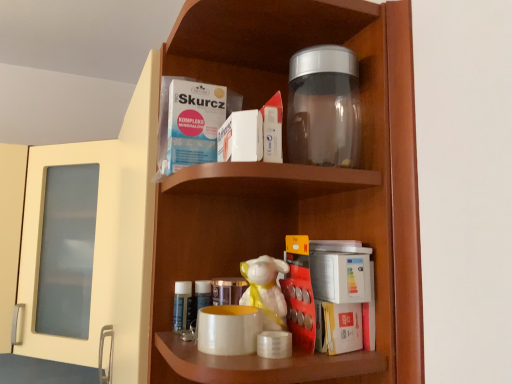
The height and width of the screenshot is (384, 512). What do you see at coordinates (297, 175) in the screenshot?
I see `transparent glass jar at upper center` at bounding box center [297, 175].

Identify the location of matte white mug at center. Image resolution: width=512 pixels, height=384 pixels. (228, 329).

This screenshot has width=512, height=384. What do you see at coordinates (228, 329) in the screenshot? I see `matte white mug at center` at bounding box center [228, 329].

What is the approximate height of transparent plastic jar at upper center?

It is 17.10 centimeters.

What is the approximate width of white glossy figurine at center?

white glossy figurine at center is 2.76 inches wide.

Identify the location of transparent glass jar at upper center. (297, 175).

Would you say matte white mug at center is a long distance from white glossy figurine at center?

They are positioned close to each other.

From the image's perspective, which is above, matte white mug at center or white glossy figurine at center?

white glossy figurine at center appears higher in the image.

Could you tell me if matte white mug at center is facing white glossy figurine at center?

No, matte white mug at center is not turned towards white glossy figurine at center.

Considering the positions of point (252, 308) and point (265, 297), is point (252, 308) closer or farther from the camera than point (265, 297)?

Point (252, 308) appears to be closer to the viewer than point (265, 297).

From a real-world perspective, who is located higher, matte white mug at center or transparent plastic jar at upper center?

From a 3D spatial view, transparent plastic jar at upper center is above.

From the image's perspective, is matte white mug at center above transparent plastic jar at upper center?

No, from the image's perspective, matte white mug at center is not above transparent plastic jar at upper center.

Is matte white mug at center smaller than transparent plastic jar at upper center?

Yes.

The image size is (512, 384). I want to click on bottle above the matte white mug at center (from the image's perspective), so click(x=324, y=107).

From the picture: From the image's perspective, who appears lower, matte white mug at center or transparent glass jar at upper center?

From the image's view, matte white mug at center is below.

How distant is matte white mug at center from transparent glass jar at upper center?

matte white mug at center is 9.31 inches away from transparent glass jar at upper center.

Does matte white mug at center appear on the right side of transparent glass jar at upper center?

Incorrect, matte white mug at center is not on the right side of transparent glass jar at upper center.

Is matte white mug at center shorter than transparent glass jar at upper center?

Indeed, matte white mug at center has a lesser height compared to transparent glass jar at upper center.

Which of these two, white glossy figurine at center or matte white mug at center, stands shorter?

Standing shorter between the two is matte white mug at center.

Based on the photo, is white glossy figurine at center inside the boundaries of matte white mug at center, or outside?

The correct answer is: outside.

Is the depth of white glossy figurine at center less than that of matte white mug at center?

No, it is behind matte white mug at center.

Based on the photo, could you tell me if white glossy figurine at center is facing matte white mug at center?

Yes, white glossy figurine at center is oriented towards matte white mug at center.

Looking at this image, is the position of transparent glass jar at upper center less distant than that of matte white mug at center?

Yes, it is in front of matte white mug at center.

From the image's perspective, is transparent glass jar at upper center above matte white mug at center?

Answer: Indeed, from the image's perspective, transparent glass jar at upper center is shown above matte white mug at center.

From a real-world perspective, who is located lower, transparent glass jar at upper center or matte white mug at center?

In real-world perspective, matte white mug at center is lower.

Who is taller, transparent glass jar at upper center or matte white mug at center?

With more height is transparent glass jar at upper center.

Consider the image. What's the angular difference between white glossy figurine at center and transparent plastic jar at upper center's facing directions?

The angle between the facing direction of white glossy figurine at center and the facing direction of transparent plastic jar at upper center is 3.42 degrees.

From a real-world perspective, does white glossy figurine at center stand above transparent plastic jar at upper center?

No, from a real-world perspective, white glossy figurine at center is not over transparent plastic jar at upper center

The width and height of the screenshot is (512, 384). Find the location of `bottle located above the white glossy figurine at center (from a real-world perspective)`. bottle located above the white glossy figurine at center (from a real-world perspective) is located at coordinates (324, 107).

Considering the positions of objects white glossy figurine at center and transparent plastic jar at upper center in the image provided, who is behind, white glossy figurine at center or transparent plastic jar at upper center?

white glossy figurine at center.

Is transparent glass jar at upper center further to camera compared to white glossy figurine at center?

No, it is in front of white glossy figurine at center.

Which object is positioned more to the left, transparent glass jar at upper center or white glossy figurine at center?

white glossy figurine at center.

Is the surface of transparent glass jar at upper center in direct contact with white glossy figurine at center?

No, transparent glass jar at upper center is not making contact with white glossy figurine at center.

At what (x,y) coordinates should I click in order to perform the action: click on toy located behind the transparent glass jar at upper center. Please return your answer as a coordinate pair (x, y). Looking at the image, I should click on (265, 290).

At what (x,y) coordinates should I click in order to perform the action: click on mug in front of the white glossy figurine at center. Please return your answer as a coordinate pair (x, y). This screenshot has width=512, height=384. Looking at the image, I should click on (228, 329).

Where is `mug below the transparent plastic jar at upper center (from a real-world perspective)`? mug below the transparent plastic jar at upper center (from a real-world perspective) is located at coordinates (228, 329).

When comparing their distances from matte white mug at center, does white glossy figurine at center or transparent plastic jar at upper center seem closer?

white glossy figurine at center lies closer to matte white mug at center than the other object.

Based on their spatial positions, is matte white mug at center or transparent plastic jar at upper center further from white glossy figurine at center?

The object further to white glossy figurine at center is transparent plastic jar at upper center.

When comparing their distances from matte white mug at center, does white glossy figurine at center or transparent glass jar at upper center seem closer?

white glossy figurine at center lies closer to matte white mug at center than the other object.

Considering their positions, is transparent glass jar at upper center positioned further to transparent plastic jar at upper center than matte white mug at center?

matte white mug at center is positioned further to the anchor transparent plastic jar at upper center.

Based on their spatial positions, is transparent plastic jar at upper center or transparent glass jar at upper center further from matte white mug at center?

transparent plastic jar at upper center is further to matte white mug at center.

Looking at the image, which one is located further to transparent glass jar at upper center, matte white mug at center or white glossy figurine at center?

Among the two, matte white mug at center is located further to transparent glass jar at upper center.

When comparing their distances from transparent plastic jar at upper center, does white glossy figurine at center or matte white mug at center seem closer?

Among the two, white glossy figurine at center is located nearer to transparent plastic jar at upper center.

Estimate the real-world distances between objects in this image. Which object is further from transparent glass jar at upper center, transparent plastic jar at upper center or matte white mug at center?

matte white mug at center.

This screenshot has height=384, width=512. I want to click on shelf between transparent plastic jar at upper center and matte white mug at center from top to bottom, so click(297, 175).

You are a GUI agent. You are given a task and a screenshot of the screen. Output one action in this format:
    pyautogui.click(x=<x>, y=<y>)
    Task: Click on the toy between transparent plastic jar at upper center and matte white mug at center in the vertical direction
    
    Given the screenshot: What is the action you would take?
    pyautogui.click(x=265, y=290)

Where is `shelf between transparent plastic jar at upper center and white glossy figurine at center vertically`? This screenshot has width=512, height=384. shelf between transparent plastic jar at upper center and white glossy figurine at center vertically is located at coordinates (297, 175).

You are a GUI agent. You are given a task and a screenshot of the screen. Output one action in this format:
    pyautogui.click(x=<x>, y=<y>)
    Task: Click on the mug between transparent glass jar at upper center and white glossy figurine at center along the z-axis
    The height and width of the screenshot is (384, 512).
    Given the screenshot: What is the action you would take?
    pyautogui.click(x=228, y=329)